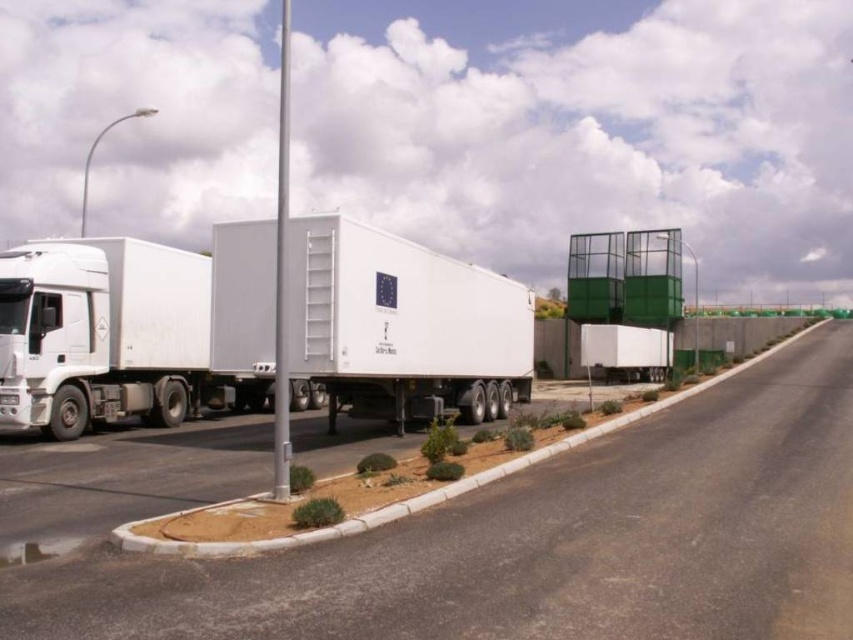
Is asphalt road at center shorter than white matte trailer truck at left?

Yes.

Is asphalt road at center above white matte trailer truck at left?

Actually, asphalt road at center is below white matte trailer truck at left.

This screenshot has height=640, width=853. Identify the location of asphalt road at center. (543, 541).

Is white matte trailer truck at center wider than white matte trailer truck at left?

Correct, the width of white matte trailer truck at center exceeds that of white matte trailer truck at left.

Which is below, white matte trailer truck at center or white matte trailer truck at left?

Positioned lower is white matte trailer truck at left.

Based on the photo, who is more distant from viewer, (451, 340) or (83, 371)?

The point (451, 340) is behind.

At what (x,y) coordinates should I click in order to perform the action: click on white matte trailer truck at center. Please return your answer as a coordinate pair (x, y). Image resolution: width=853 pixels, height=640 pixels. Looking at the image, I should click on (403, 324).

Between asphalt road at center and white matte trailer truck at center, which one appears on the right side from the viewer's perspective?

Positioned to the right is asphalt road at center.

Does asphalt road at center lie in front of white matte trailer truck at center?

Yes, asphalt road at center is closer to the viewer.

Between point (138, 614) and point (502, 305), which one is positioned in front?

Point (138, 614) is in front.

Find the location of a particular element. asphalt road at center is located at coordinates (543, 541).